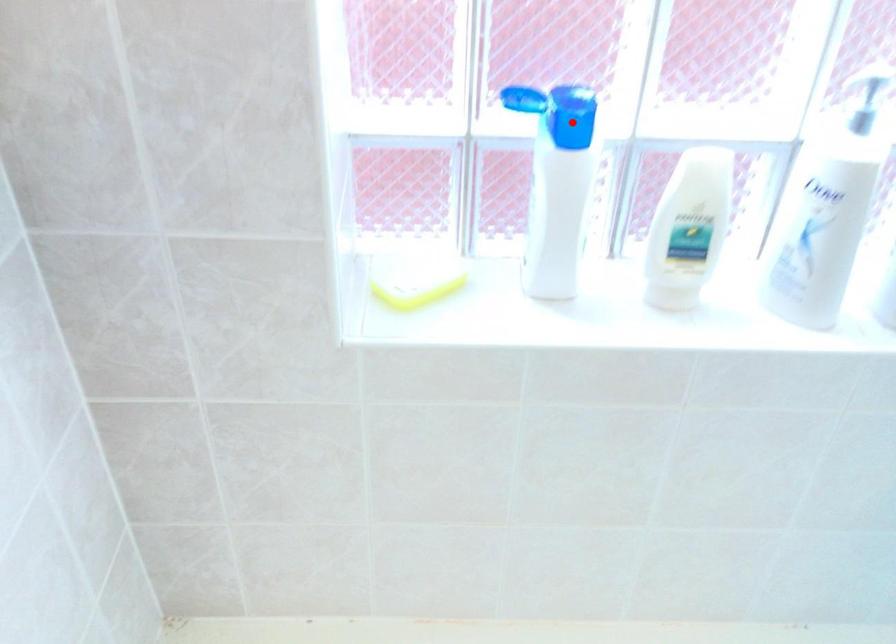
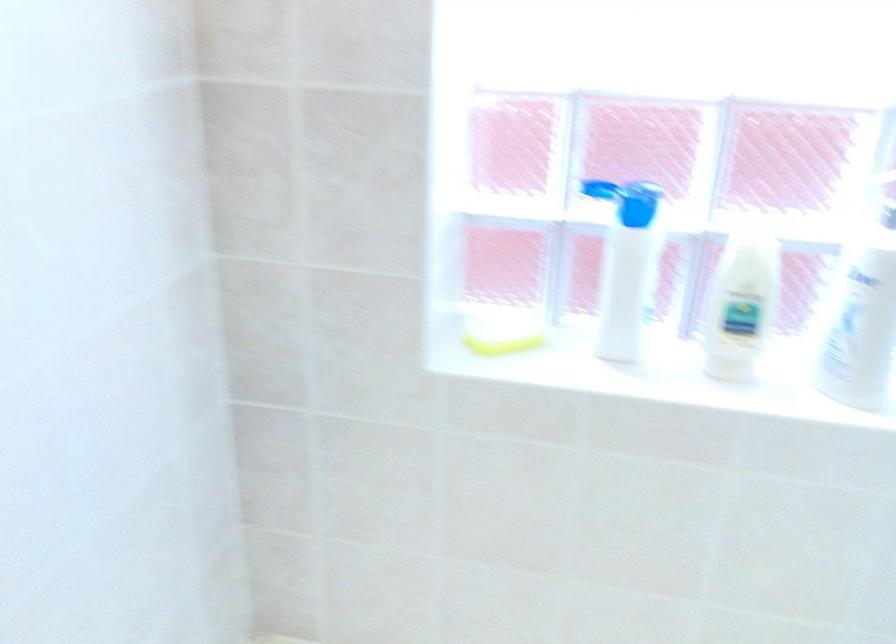
In the second image, find the point that corresponds to the highlighted location in the first image.

(636, 203)